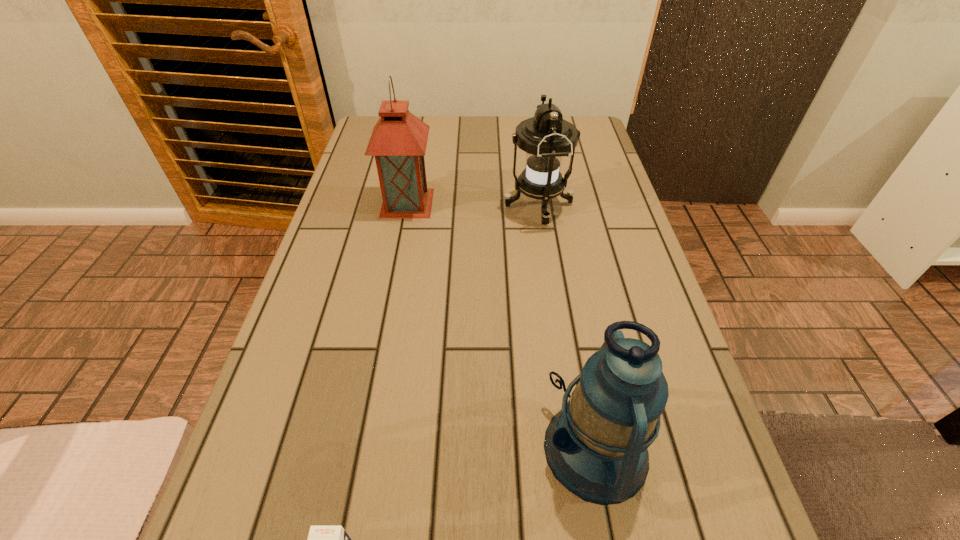
This screenshot has height=540, width=960. I want to click on vacant region between the nearest lantern and the leftmost lantern, so click(x=501, y=326).

Where is `free spot between the second nearest object and the leftmost lantern`? The height and width of the screenshot is (540, 960). free spot between the second nearest object and the leftmost lantern is located at coordinates (501, 326).

Find the location of a particular element. object that can be found as the third closest to the nearest lantern is located at coordinates (399, 139).

This screenshot has width=960, height=540. In order to click on object that can be found as the second closest to the nearest lantern in this screenshot , I will do `click(547, 137)`.

Identify the location of lantern object that ranks as the third closest to the chocolate milk. (399, 139).

Select which lantern appears as the third closest to the nearest object. Please provide its 2D coordinates. Your answer should be formatted as a tuple, i.e. [(x, y)], where the tuple contains the x and y coordinates of a point satisfying the conditions above.

[(399, 139)]